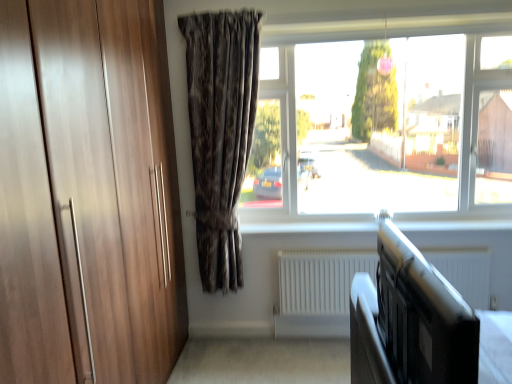
Find the location of a particular element. This screenshot has width=512, height=384. vacant space underneath dark brown textured curtain at center (from a real-world perspective) is located at coordinates pos(229,345).